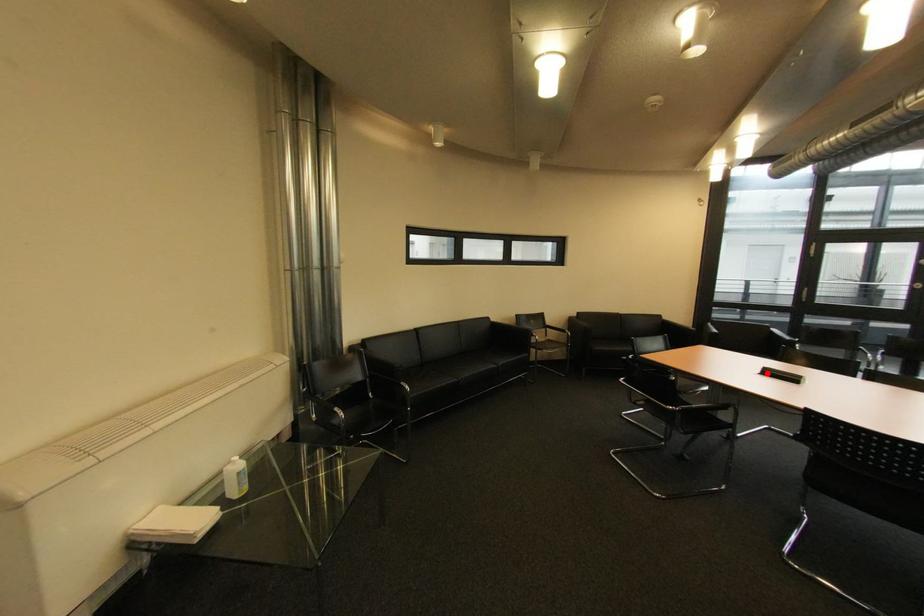
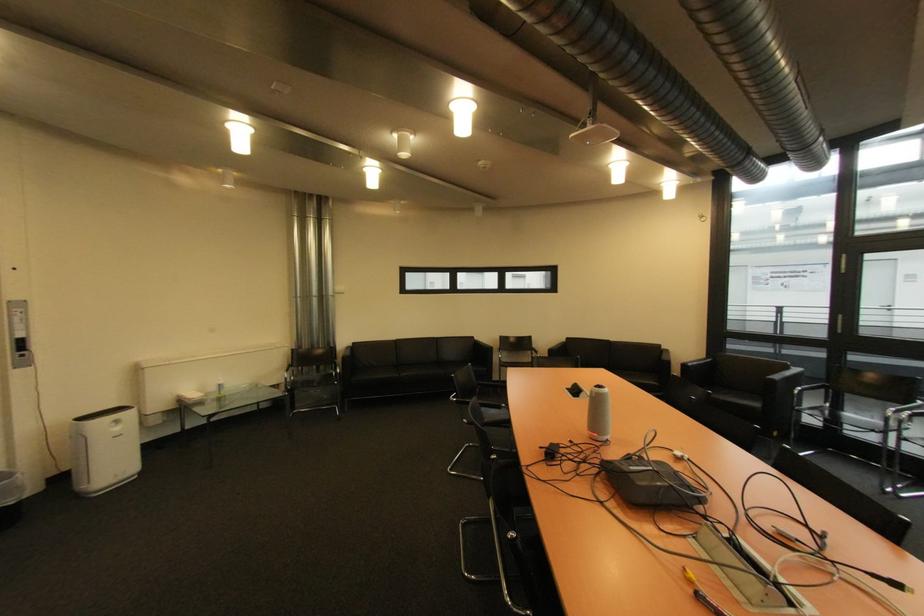
Find the pixel in the second image that matches the highlighted location in the first image.

(578, 389)